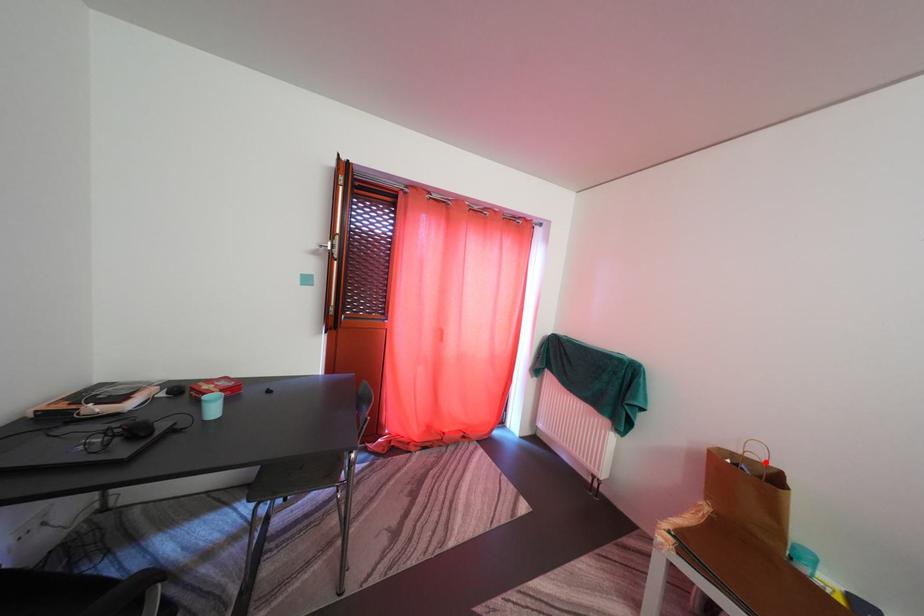
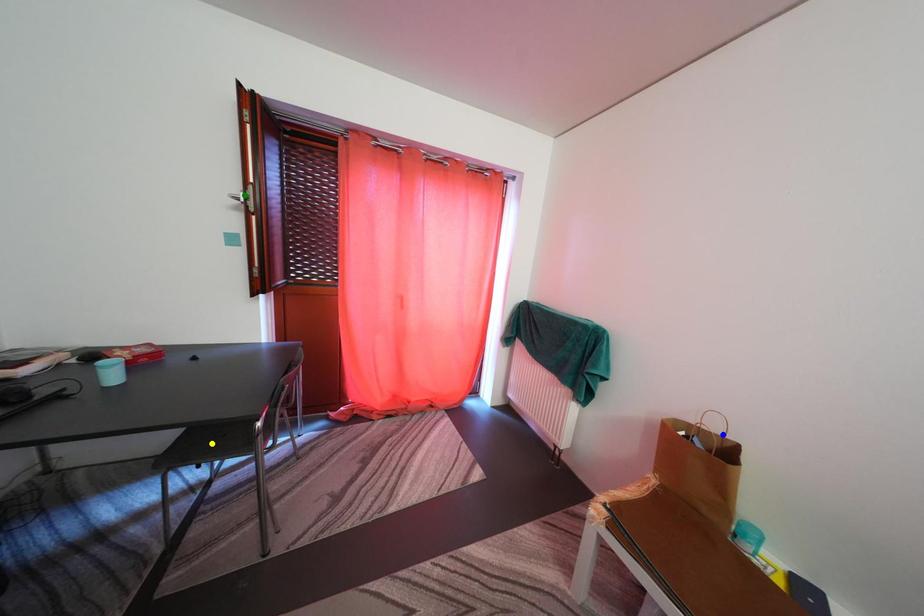
Question: I am providing you with two images of the same scene from different viewpoints. A red point is marked on the first image. You are given multiple points on the second image. Which point in image 2 is actually the same real-world point as the red point in image 1?

Choices:
 (A) green point
 (B) yellow point
 (C) blue point

Answer: (C)